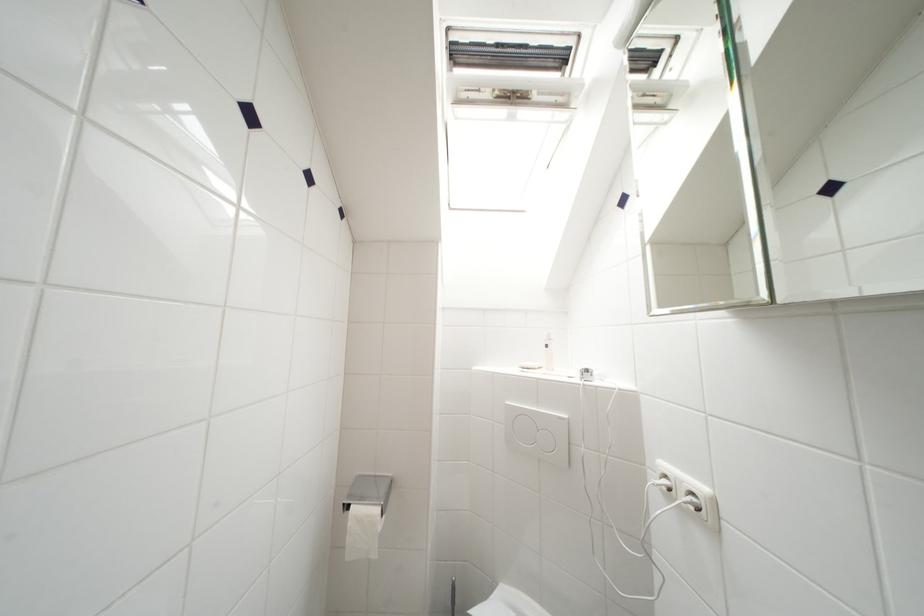
You are a GUI agent. You are given a task and a screenshot of the screen. Output one action in this format:
    pyautogui.click(x=<x>, y=<y>)
    Task: Click on the white pump top
    
    Given the screenshot: What is the action you would take?
    pyautogui.click(x=512, y=70)